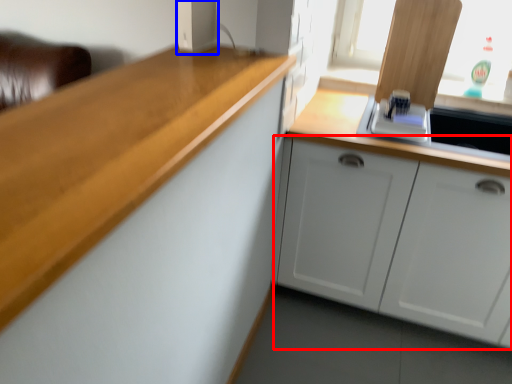
Question: Which point is closer to the camera, cabinetry (highlighted by a red box) or appliance (highlighted by a blue box)?

Choices:
 (A) cabinetry
 (B) appliance

Answer: (B)